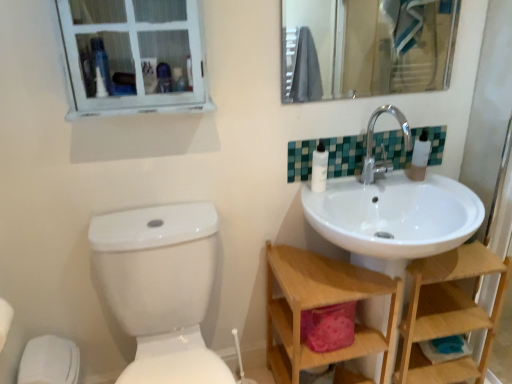
The width and height of the screenshot is (512, 384). What do you see at coordinates (345, 155) in the screenshot?
I see `teal mosaic tiles at upper right` at bounding box center [345, 155].

The width and height of the screenshot is (512, 384). What do you see at coordinates (420, 157) in the screenshot? I see `white plastic bottles at upper right` at bounding box center [420, 157].

This screenshot has width=512, height=384. I want to click on white wooden window at upper left, so click(134, 56).

What do you see at coordinates (319, 168) in the screenshot? This screenshot has width=512, height=384. I see `white matte toilet paper at upper center` at bounding box center [319, 168].

Find the location of a particular element. Image resolution: width=512 pixels, height=384 pixels. white matte toilet paper at upper center is located at coordinates (319, 168).

What do you see at coordinates (448, 313) in the screenshot? The image size is (512, 384). I see `wooden at right, the 1th shelf positioned from the right` at bounding box center [448, 313].

You are a GUI agent. You are given a task and a screenshot of the screen. Output one action in this format:
    pyautogui.click(x=<x>, y=<y>)
    Task: Click on the teal mosaic tiles at upper right
    The image size is (512, 384).
    Given the screenshot: What is the action you would take?
    pyautogui.click(x=345, y=155)

You are a GUI agent. You are given a task and a screenshot of the screen. Output one action in this format:
    pyautogui.click(x=<x>, y=<y>)
    Task: Click on the tap in front of the wooden at right, the second shelf positioned from the left
    This screenshot has height=384, width=512.
    Given the screenshot: What is the action you would take?
    pyautogui.click(x=372, y=143)

Considering their positions, is wooden at right, the second shelf positioned from the left, located in front of or behind chrome metallic faucet at upper right?

Clearly, wooden at right, the second shelf positioned from the left, is behind chrome metallic faucet at upper right.

Which of these two, wooden at right, the second shelf positioned from the left, or chrome metallic faucet at upper right, is thinner?

chrome metallic faucet at upper right is thinner.

Would you say wooden shelf at lower right, placed as the 1th shelf when sorted from left to right, is inside or outside clear glass mirror at upper center?

wooden shelf at lower right, placed as the 1th shelf when sorted from left to right, exists outside the volume of clear glass mirror at upper center.

From the image's perspective, between wooden shelf at lower right, the second shelf viewed from the right, and clear glass mirror at upper center, which one is located above?

clear glass mirror at upper center is shown above in the image.

Is white glossy toilet at lower left beside chrome metallic faucet at upper right?

white glossy toilet at lower left and chrome metallic faucet at upper right are not in contact.

Between white glossy toilet at lower left and chrome metallic faucet at upper right, which one has more height?

Standing taller between the two is white glossy toilet at lower left.

In order to click on toilet below the chrome metallic faucet at upper right (from the image's perspective) in this screenshot , I will do `click(161, 288)`.

Does point (190, 298) appear closer or farther from the camera than point (376, 112)?

Point (190, 298) is positioned closer to the camera compared to point (376, 112).

Based on the photo, who is taller, white wooden window at upper left or chrome metallic faucet at upper right?

white wooden window at upper left is taller.

Which of these two, white wooden window at upper left or chrome metallic faucet at upper right, is thinner?

Thinner between the two is white wooden window at upper left.

Which point is more forward, (174, 49) or (409, 148)?

The point (174, 49) is closer to the camera.

Is white matte toilet paper at upper center oriented towards teal mosaic tiles at upper right?

No, white matte toilet paper at upper center is not facing towards teal mosaic tiles at upper right.

Which object is positioned more to the right, white matte toilet paper at upper center or teal mosaic tiles at upper right?

teal mosaic tiles at upper right is more to the right.

Based on the photo, from the image's perspective, would you say white matte toilet paper at upper center is positioned over teal mosaic tiles at upper right?

No, from the image's perspective, white matte toilet paper at upper center is not above teal mosaic tiles at upper right.

Does white matte toilet paper at upper center have a larger size compared to teal mosaic tiles at upper right?

Actually, white matte toilet paper at upper center might be smaller than teal mosaic tiles at upper right.

Can you see wooden shelf at lower right, the second shelf viewed from the right, touching white plastic bottles at upper right?

They are not placed beside each other.

Does wooden shelf at lower right, placed as the 1th shelf when sorted from left to right, lie behind white plastic bottles at upper right?

No.

Visually, is wooden shelf at lower right, the second shelf viewed from the right, positioned to the left or to the right of white plastic bottles at upper right?

Clearly, wooden shelf at lower right, the second shelf viewed from the right, is on the left of white plastic bottles at upper right in the image.

Which point is more distant from viewer, (294, 253) or (413, 159)?

The point (294, 253) is farther from the camera.

Can you confirm if teal mosaic tiles at upper right is shorter than white wooden window at upper left?

Yes, teal mosaic tiles at upper right is shorter than white wooden window at upper left.

Would you say teal mosaic tiles at upper right is inside or outside white wooden window at upper left?

teal mosaic tiles at upper right is not enclosed by white wooden window at upper left.

Considering the relative positions of teal mosaic tiles at upper right and white wooden window at upper left in the image provided, is teal mosaic tiles at upper right to the left of white wooden window at upper left from the viewer's perspective?

In fact, teal mosaic tiles at upper right is to the right of white wooden window at upper left.

Can you tell me how much teal mosaic tiles at upper right and white wooden window at upper left differ in facing direction?

They differ by 0.685 degrees in their facing directions.

This screenshot has height=384, width=512. Find the location of `tap above the wooden at right, the 1th shelf positioned from the right (from a real-world perspective)`. tap above the wooden at right, the 1th shelf positioned from the right (from a real-world perspective) is located at coordinates (372, 143).

Find the location of `shelf in front of the clear glass mirror at upper center`. shelf in front of the clear glass mirror at upper center is located at coordinates (320, 306).

Which object lies further to the anchor point chrome metallic faucet at upper right, white matte toilet paper at upper center or white plastic bottles at upper right?

white matte toilet paper at upper center is positioned further to the anchor chrome metallic faucet at upper right.

Estimate the real-world distances between objects in this image. Which object is closer to clear glass mirror at upper center, wooden at right, the 1th shelf positioned from the right, or chrome metallic faucet at upper right?

chrome metallic faucet at upper right lies closer to clear glass mirror at upper center than the other object.

Considering their positions, is white wooden window at upper left positioned further to teal mosaic tiles at upper right than wooden at right, the 1th shelf positioned from the right?

white wooden window at upper left.

Considering their positions, is clear glass mirror at upper center positioned closer to white matte toilet paper at upper center than white wooden window at upper left?

white wooden window at upper left lies closer to white matte toilet paper at upper center than the other object.

From the image, which object appears to be farther from clear glass mirror at upper center, teal mosaic tiles at upper right or wooden shelf at lower right, placed as the 1th shelf when sorted from left to right?

wooden shelf at lower right, placed as the 1th shelf when sorted from left to right.

Based on the photo, estimate the real-world distances between objects in this image. Which object is closer to wooden at right, the second shelf positioned from the left, white matte toilet paper at upper center or chrome metallic faucet at upper right?

Among the two, chrome metallic faucet at upper right is located nearer to wooden at right, the second shelf positioned from the left.

Based on the photo, based on their spatial positions, is white wooden window at upper left or teal mosaic tiles at upper right closer to clear glass mirror at upper center?

The object closer to clear glass mirror at upper center is teal mosaic tiles at upper right.

Looking at the image, which one is located further to clear glass mirror at upper center, white matte toilet paper at upper center or chrome metallic faucet at upper right?

white matte toilet paper at upper center is further to clear glass mirror at upper center.

Where is `toilet paper between white wooden window at upper left and wooden at right, the 1th shelf positioned from the right`? This screenshot has width=512, height=384. toilet paper between white wooden window at upper left and wooden at right, the 1th shelf positioned from the right is located at coordinates (319, 168).

This screenshot has width=512, height=384. What are the coordinates of `shelf between white wooden window at upper left and white plastic bottles at upper right from left to right` in the screenshot? It's located at (320, 306).

Locate an element on the screen. tile situated between white glossy toilet at lower left and chrome metallic faucet at upper right from left to right is located at coordinates (345, 155).

I want to click on toilet paper between teal mosaic tiles at upper right and wooden shelf at lower right, the second shelf viewed from the right, in the up-down direction, so click(x=319, y=168).